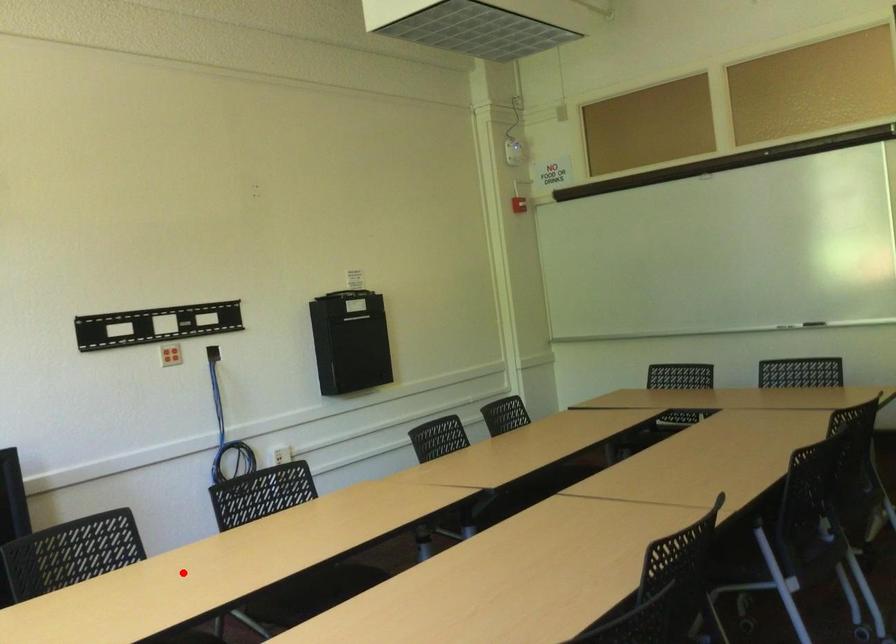
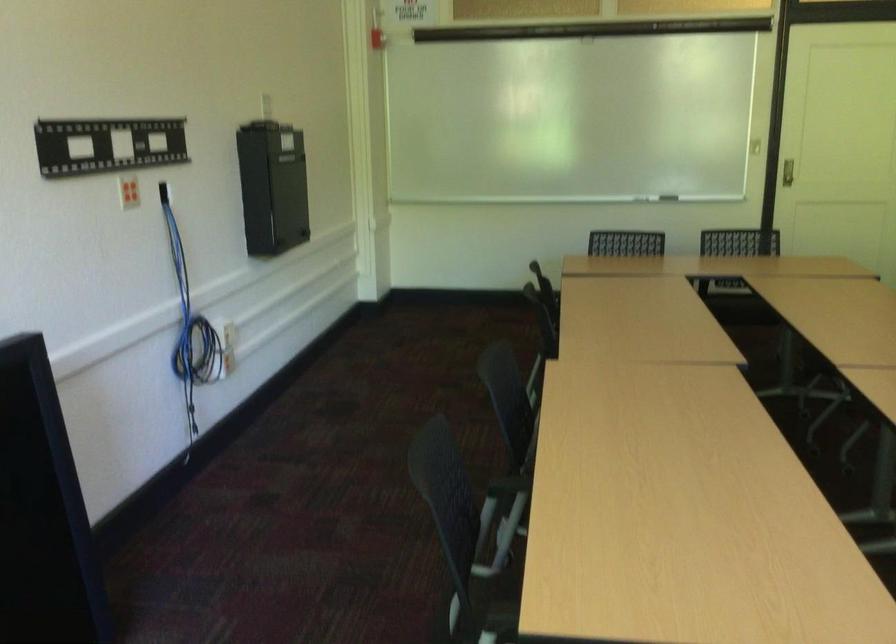
In the second image, find the point that corresponds to the highlighted location in the first image.

(506, 486)